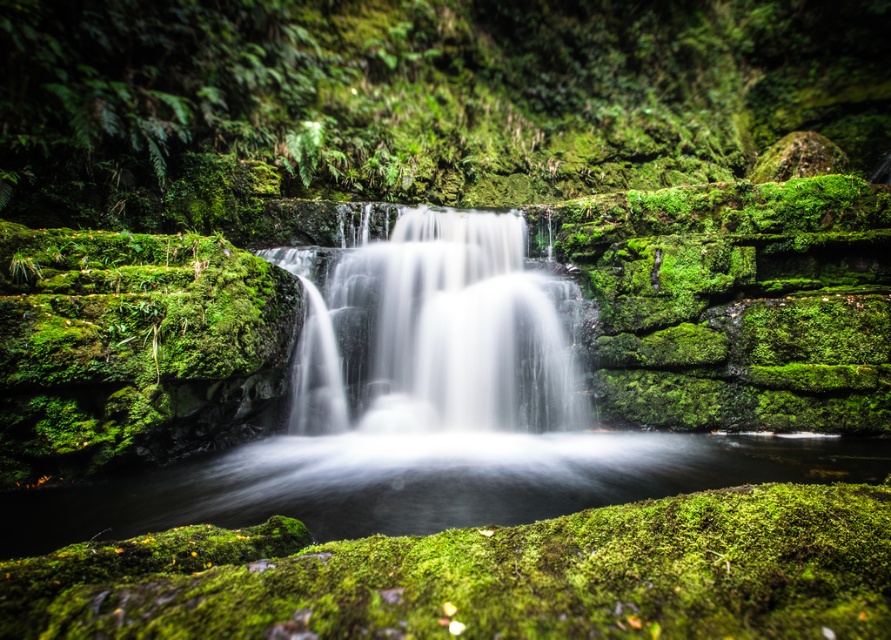
Looking at this image, who is higher up, green mossy rock at center or white silky water at center?

green mossy rock at center

Where is `green mossy rock at center`? This screenshot has height=640, width=891. green mossy rock at center is located at coordinates (x=423, y=93).

Locate an element on the screen. The width and height of the screenshot is (891, 640). green mossy rock at center is located at coordinates (423, 93).